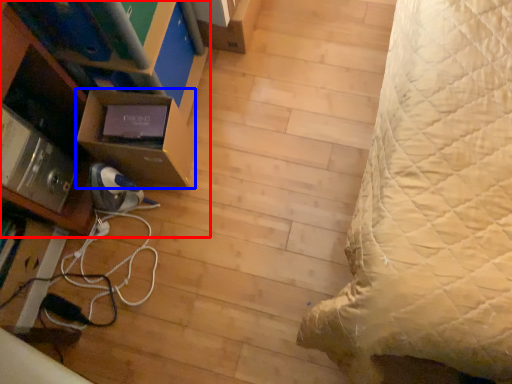
Question: Which point is further to the camera, furniture (highlighted by a red box) or shelf (highlighted by a blue box)?

Choices:
 (A) furniture
 (B) shelf

Answer: (B)